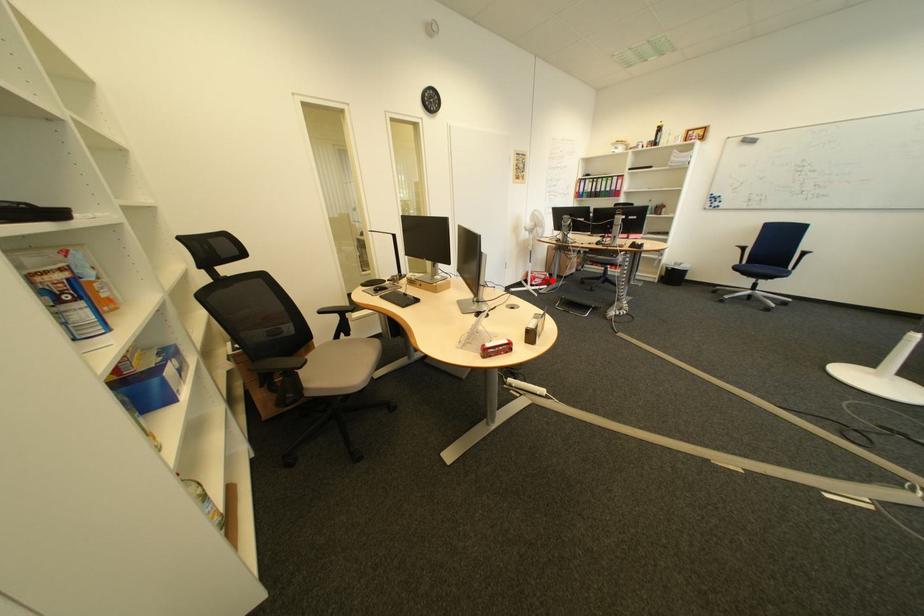
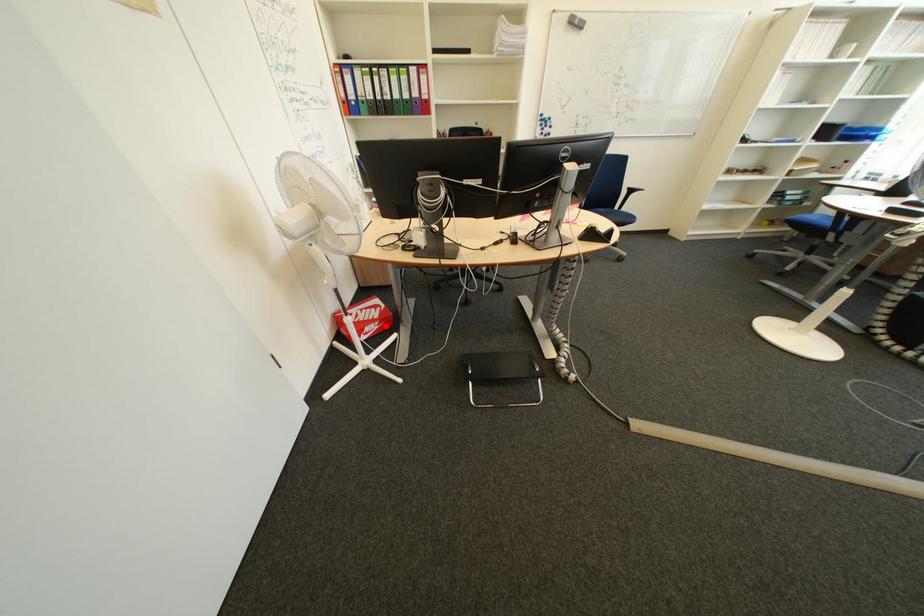
I am providing you with two images of the same scene from different viewpoints. A red point is marked on the first image and another point is marked on the second image. Does the point marked in image1 correspond to the same location as the one in image2?

Yes